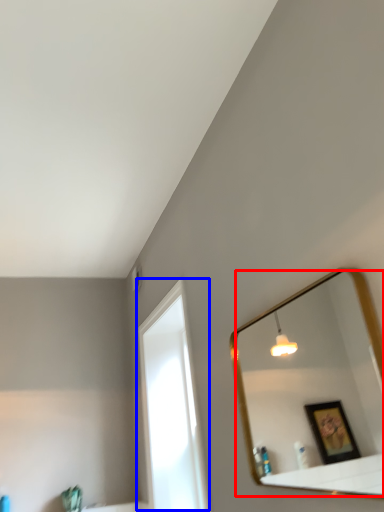
Question: Which of the following is the closest to the observer, mirror (highlighted by a red box) or window (highlighted by a blue box)?

Choices:
 (A) mirror
 (B) window

Answer: (A)